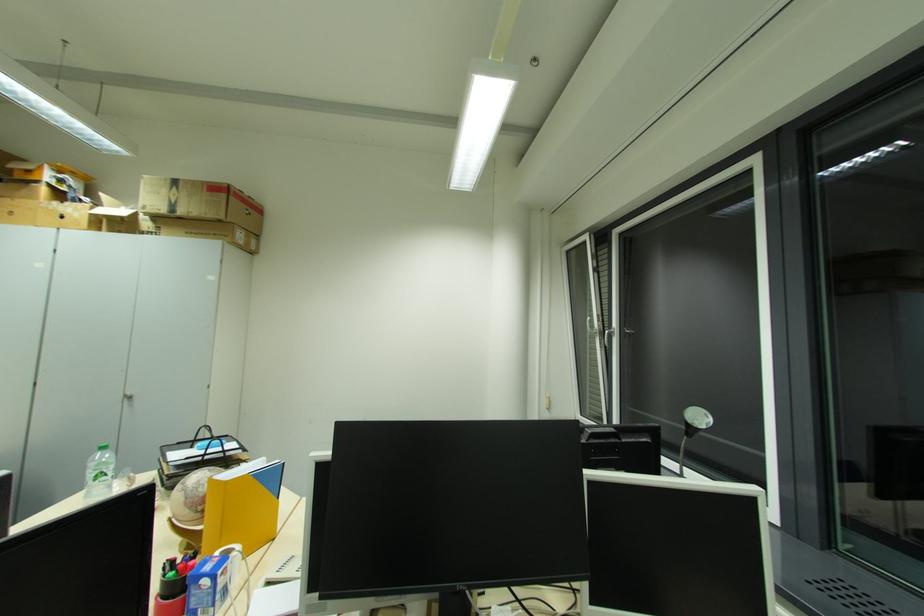
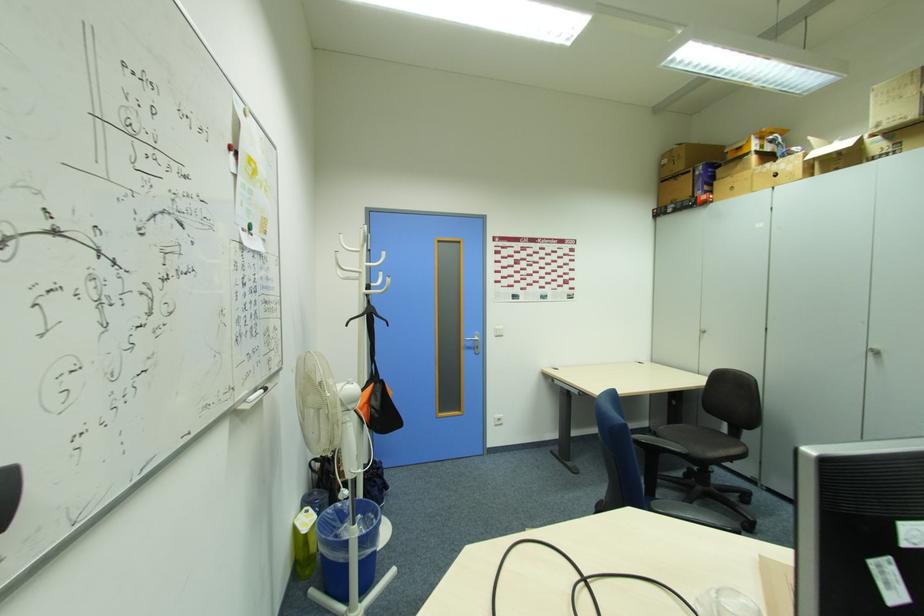
Find the pixel in the second image that matches (66,217) in the first image.

(779, 176)